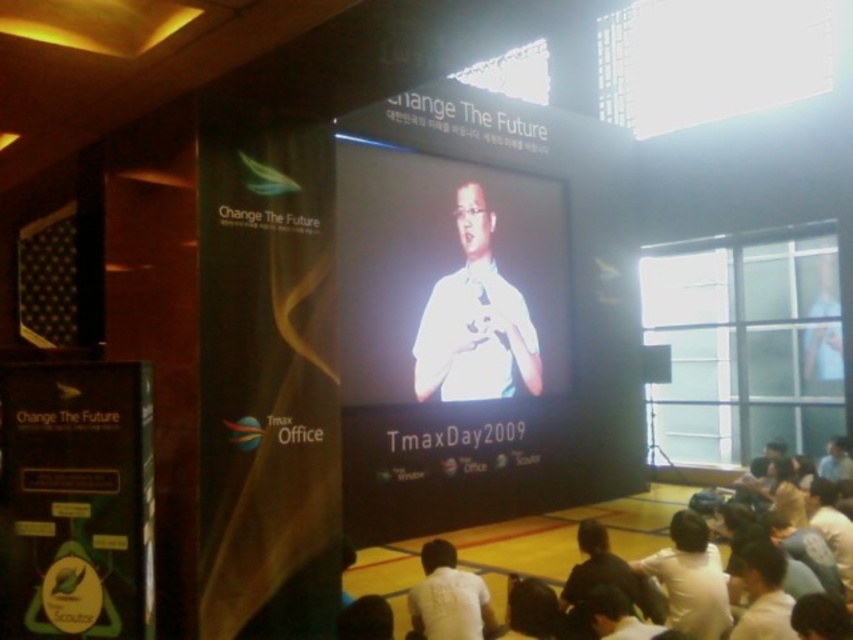
Does white cotton shirt at lower center appear on the left side of white matte shirt at lower center?

In fact, white cotton shirt at lower center is to the right of white matte shirt at lower center.

Who is lower down, white cotton shirt at lower center or white matte shirt at lower center?

Positioned lower is white cotton shirt at lower center.

Between point (651, 541) and point (465, 614), which one is positioned in front?

Positioned in front is point (465, 614).

Identify the location of white cotton shirt at lower center. (567, 538).

In the scene shown: Which is above, white glossy screen at center or white matte shirt at lower center?

white glossy screen at center

Can you confirm if white glossy screen at center is positioned to the left of white matte shirt at lower center?

Incorrect, white glossy screen at center is not on the left side of white matte shirt at lower center.

Is point (469, 262) less distant than point (466, 579)?

No, it is behind (466, 579).

At what (x,y) coordinates should I click in order to perform the action: click on white glossy screen at center. Please return your answer as a coordinate pair (x, y). The height and width of the screenshot is (640, 853). Looking at the image, I should click on (448, 280).

Can you confirm if white cotton shirt at lower center is taller than white matte shirt at center?

No, white cotton shirt at lower center is not taller than white matte shirt at center.

Is white cotton shirt at lower center bigger than white matte shirt at center?

No.

Does point (467, 529) come in front of point (492, 316)?

Yes, it is.

Where is `white cotton shirt at lower center`? The height and width of the screenshot is (640, 853). white cotton shirt at lower center is located at coordinates (567, 538).